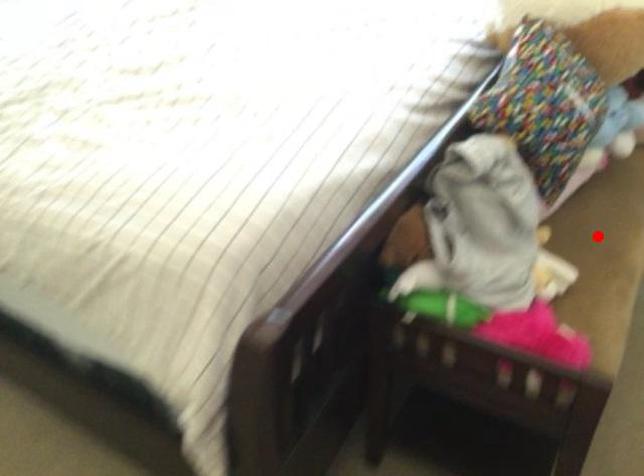
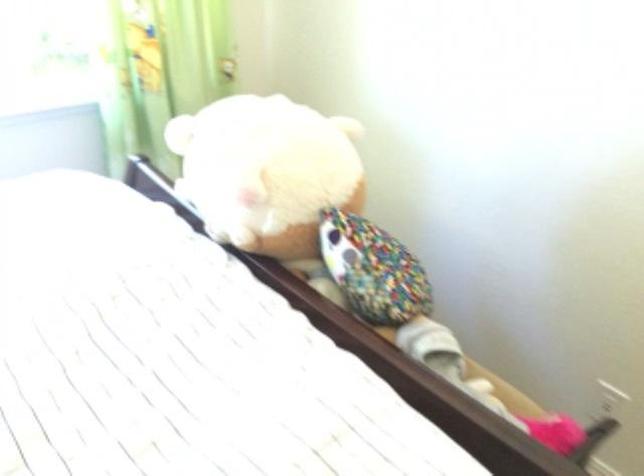
Question: I am providing you with two images of the same scene from different viewpoints. A red point is marked on the first image. Is the red point's position out of view in image 2?

Choices:
 (A) Yes
 (B) No

Answer: (A)